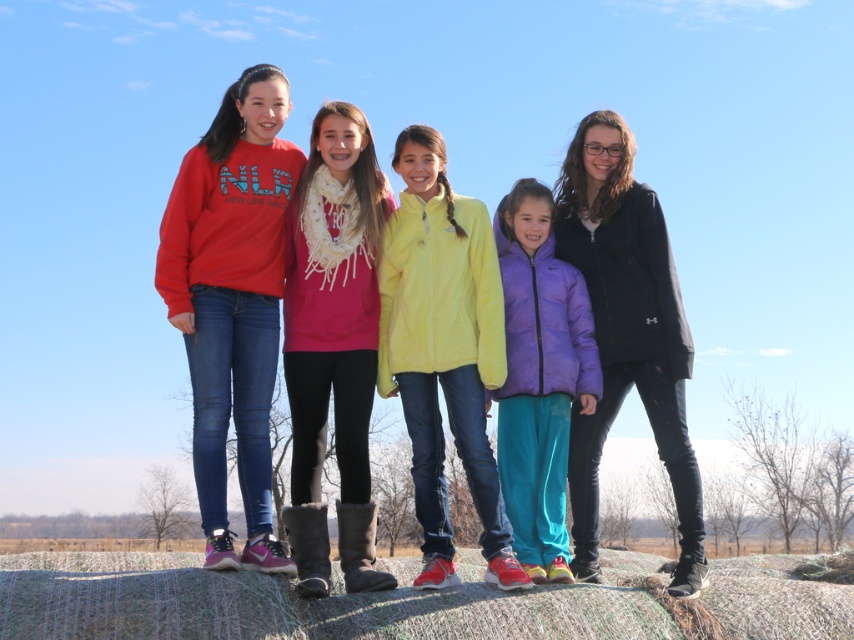
How far apart are white knit scarf at center and purple puffer jacket at center?

A distance of 2.68 meters exists between white knit scarf at center and purple puffer jacket at center.

Measure the distance from white knit scarf at center to purple puffer jacket at center.

white knit scarf at center and purple puffer jacket at center are 2.68 meters apart from each other.

The height and width of the screenshot is (640, 854). Find the location of `white knit scarf at center`. white knit scarf at center is located at coordinates (332, 342).

Can you confirm if matte fleece jackets at center is positioned to the left of light yellow fleece jacket at center?

Incorrect, matte fleece jackets at center is not on the left side of light yellow fleece jacket at center.

Is matte fleece jackets at center further to the viewer compared to light yellow fleece jacket at center?

No, it is in front of light yellow fleece jacket at center.

Who is more distant from viewer, (x=361, y=385) or (x=445, y=332)?

The point (x=361, y=385) is behind.

This screenshot has width=854, height=640. I want to click on matte fleece jackets at center, so click(442, 452).

Who is higher up, white knit scarf at center or black matte jacket at right?

black matte jacket at right is higher up.

Locate an element on the screen. white knit scarf at center is located at coordinates (332, 342).